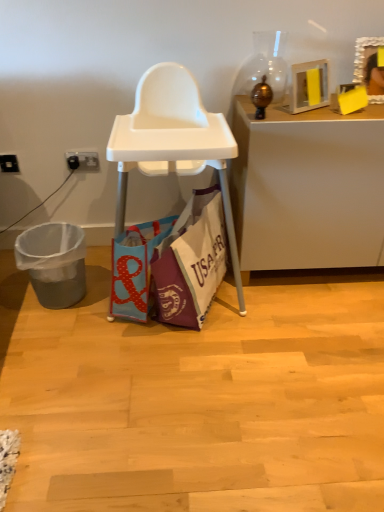
Identify the location of vacant region under gray plastic trash can at lower left (from a real-world perspective). This screenshot has height=512, width=384. [82, 297].